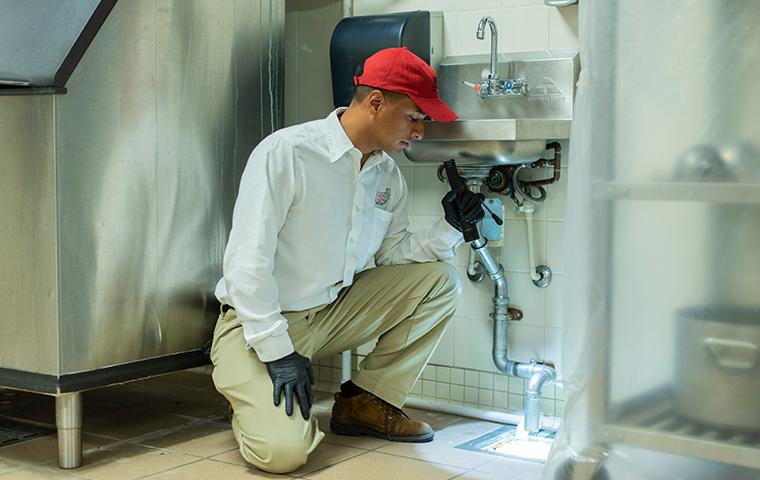
Find the location of a particular element. shelves is located at coordinates (628, 436), (670, 192).